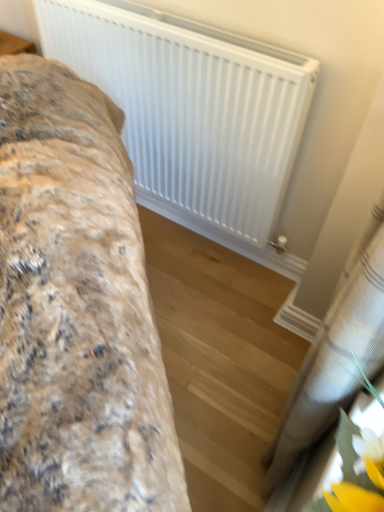
You are a GUI agent. You are given a task and a screenshot of the screen. Output one action in this format:
    pyautogui.click(x=<x>, y=<y>)
    Task: Click on the white matte radiator at upper center
    
    Given the screenshot: What is the action you would take?
    pyautogui.click(x=191, y=108)

Where is `fluffy fabric bed at left`? fluffy fabric bed at left is located at coordinates (76, 308).

Is fluffy fabric bed at left not close to white matte radiator at upper center?

fluffy fabric bed at left is near white matte radiator at upper center, not far away.

Visually, is fluffy fabric bed at left positioned to the left or to the right of white matte radiator at upper center?

Clearly, fluffy fabric bed at left is on the left of white matte radiator at upper center in the image.

Which is in front, point (143, 356) or point (216, 196)?

Point (143, 356)

Is fluffy fabric bed at left oriented towards white matte radiator at upper center?

No, fluffy fabric bed at left is not aimed at white matte radiator at upper center.

Are white matte radiator at upper center and white sheer curtain at lower right making contact?

No, white matte radiator at upper center is not next to white sheer curtain at lower right.

Who is smaller, white matte radiator at upper center or white sheer curtain at lower right?

Smaller between the two is white sheer curtain at lower right.

Which is in front, point (220, 143) or point (301, 404)?

The point (301, 404) is closer to the camera.

In terms of width, does white matte radiator at upper center look wider or thinner when compared to white sheer curtain at lower right?

white matte radiator at upper center is thinner than white sheer curtain at lower right.

From the image's perspective, which is below, fluffy fabric bed at left or white sheer curtain at lower right?

From the image's view, white sheer curtain at lower right is below.

How many degrees apart are the facing directions of fluffy fabric bed at left and white sheer curtain at lower right?

fluffy fabric bed at left and white sheer curtain at lower right are facing 47.2 degrees away from each other.

Is fluffy fabric bed at left completely or partially outside of white sheer curtain at lower right?

fluffy fabric bed at left is positioned outside white sheer curtain at lower right.

Where is `curtain located on the right of fluffy fabric bed at left`? curtain located on the right of fluffy fabric bed at left is located at coordinates (333, 360).

Consider the image. Is white matte radiator at upper center in front of fluffy fabric bed at left?

No, white matte radiator at upper center is further to the viewer.

From a real-world perspective, is white matte radiator at upper center beneath fluffy fabric bed at left?

No.

Considering the sizes of objects white matte radiator at upper center and fluffy fabric bed at left in the image provided, who is bigger, white matte radiator at upper center or fluffy fabric bed at left?

With larger size is fluffy fabric bed at left.

Is white matte radiator at upper center wider or thinner than fluffy fabric bed at left?

Considering their sizes, white matte radiator at upper center looks slimmer than fluffy fabric bed at left.

The image size is (384, 512). I want to click on curtain above the white matte radiator at upper center (from a real-world perspective), so [x=333, y=360].

Considering the sizes of objects white sheer curtain at lower right and white matte radiator at upper center in the image provided, who is smaller, white sheer curtain at lower right or white matte radiator at upper center?

white sheer curtain at lower right is smaller.

Is point (297, 400) positioned before point (294, 142)?

Yes, point (297, 400) is in front of point (294, 142).

Which object is positioned more to the left, white sheer curtain at lower right or white matte radiator at upper center?

Positioned to the left is white matte radiator at upper center.

Is white sheer curtain at lower right turned away from fluffy fabric bed at left?

That's not correct — white sheer curtain at lower right is not looking away from fluffy fabric bed at left.

Find the location of a particular element. The image size is (384, 512). furniture below the white sheer curtain at lower right (from a real-world perspective) is located at coordinates (76, 308).

How different are the orientations of white sheer curtain at lower right and fluffy fabric bed at left in degrees?

The angular difference between white sheer curtain at lower right and fluffy fabric bed at left is 47.2 degrees.

Which object is closer to the camera taking this photo, white sheer curtain at lower right or fluffy fabric bed at left?

Positioned in front is white sheer curtain at lower right.

Identify the location of radiator located on the right of fluffy fabric bed at left. (191, 108).

Image resolution: width=384 pixels, height=512 pixels. I want to click on radiator behind the white sheer curtain at lower right, so click(191, 108).

Estimate the real-world distances between objects in this image. Which object is further from white matte radiator at upper center, fluffy fabric bed at left or white sheer curtain at lower right?

white sheer curtain at lower right.

When comparing their distances from white sheer curtain at lower right, does white matte radiator at upper center or fluffy fabric bed at left seem closer?

fluffy fabric bed at left is closer to white sheer curtain at lower right.

When comparing their distances from white sheer curtain at lower right, does fluffy fabric bed at left or white matte radiator at upper center seem further?

white matte radiator at upper center.

Considering their positions, is white matte radiator at upper center positioned further to fluffy fabric bed at left than white sheer curtain at lower right?

Among the two, white matte radiator at upper center is located further to fluffy fabric bed at left.

When comparing their distances from white matte radiator at upper center, does white sheer curtain at lower right or fluffy fabric bed at left seem further?

Based on the image, white sheer curtain at lower right appears to be further to white matte radiator at upper center.

Considering their positions, is white sheer curtain at lower right positioned closer to fluffy fabric bed at left than white matte radiator at upper center?

Based on the image, white sheer curtain at lower right appears to be nearer to fluffy fabric bed at left.

This screenshot has height=512, width=384. What are the coordinates of `furniture between white sheer curtain at lower right and white matte radiator at upper center in the front-back direction` in the screenshot? It's located at (76, 308).